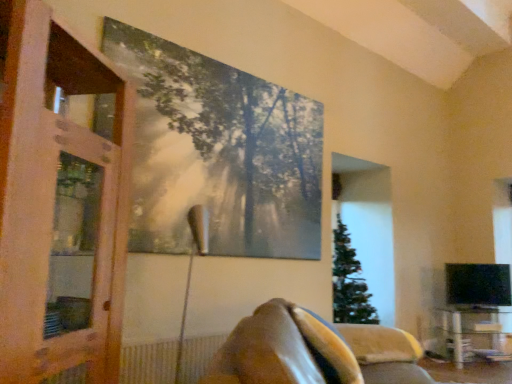
Question: Is velvety brown pillow at lower center not within metallic silver tree at upper center?

Choices:
 (A) no
 (B) yes

Answer: (B)

Question: Are velvety brown pillow at lower center and metallic silver tree at upper center making contact?

Choices:
 (A) no
 (B) yes

Answer: (A)

Question: Is velvety brown pillow at lower center facing away from metallic silver tree at upper center?

Choices:
 (A) yes
 (B) no

Answer: (B)

Question: Can metallic silver tree at upper center be found inside velvety brown pillow at lower center?

Choices:
 (A) yes
 (B) no

Answer: (B)

Question: Is velvety brown pillow at lower center positioned behind metallic silver tree at upper center?

Choices:
 (A) yes
 (B) no

Answer: (B)

Question: Is brown leather couch at lower center situated inside metallic silver tree at upper center or outside?

Choices:
 (A) inside
 (B) outside

Answer: (B)

Question: From their relative heights in the image, would you say brown leather couch at lower center is taller or shorter than metallic silver tree at upper center?

Choices:
 (A) tall
 (B) short

Answer: (B)

Question: Considering their positions, is brown leather couch at lower center located in front of or behind metallic silver tree at upper center?

Choices:
 (A) behind
 (B) front

Answer: (B)

Question: Is brown leather couch at lower center bigger or smaller than metallic silver tree at upper center?

Choices:
 (A) big
 (B) small

Answer: (A)

Question: Is velvety brown pillow at lower center taller or shorter than metallic silver tree at upper center?

Choices:
 (A) short
 (B) tall

Answer: (A)

Question: From a real-world perspective, is velvety brown pillow at lower center positioned above or below metallic silver tree at upper center?

Choices:
 (A) below
 (B) above

Answer: (A)

Question: Is point (328, 322) positioned closer to the camera than point (308, 140)?

Choices:
 (A) closer
 (B) farther

Answer: (A)

Question: Is velvety brown pillow at lower center situated inside metallic silver tree at upper center or outside?

Choices:
 (A) outside
 (B) inside

Answer: (A)

Question: Relative to velvety brown pillow at lower center, is wooden screen door at left in front or behind?

Choices:
 (A) front
 (B) behind

Answer: (A)

Question: Looking at the image, does wooden screen door at left seem bigger or smaller compared to velvety brown pillow at lower center?

Choices:
 (A) big
 (B) small

Answer: (A)